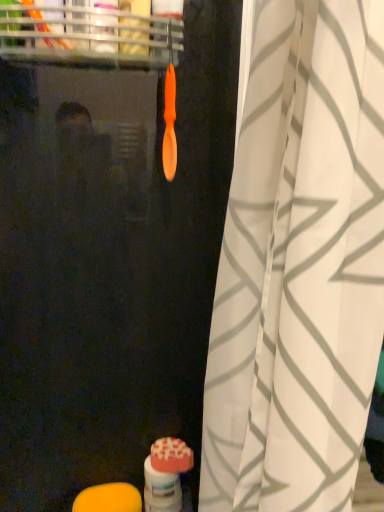
Question: Is orange matte soap at lower left, which is the second soap from top to bottom, a part of matte orange toothbrush at lower center?

Choices:
 (A) no
 (B) yes

Answer: (A)

Question: Can you confirm if matte orange toothbrush at lower center is shorter than orange matte soap at lower left, positioned as the first soap in left-to-right order?

Choices:
 (A) no
 (B) yes

Answer: (A)

Question: Is matte orange toothbrush at lower center facing towards orange matte soap at lower left, which is the 1th soap from bottom to top?

Choices:
 (A) no
 (B) yes

Answer: (A)

Question: Is the depth of matte orange toothbrush at lower center less than that of orange matte soap at lower left, which is the second soap from top to bottom?

Choices:
 (A) no
 (B) yes

Answer: (A)

Question: From a real-world perspective, is matte orange toothbrush at lower center positioned over orange matte soap at lower left, which is the 1th soap from bottom to top, based on gravity?

Choices:
 (A) yes
 (B) no

Answer: (A)

Question: Is matte orange toothbrush at lower center not inside orange matte soap at lower left, positioned as the first soap in left-to-right order?

Choices:
 (A) yes
 (B) no

Answer: (A)

Question: Is orange matte soap at lower left, positioned as the first soap in left-to-right order, next to matte pink soap at lower center, which is counted as the 1th soap, starting from the top?

Choices:
 (A) yes
 (B) no

Answer: (B)

Question: Does orange matte soap at lower left, positioned as the first soap in left-to-right order, have a larger size compared to matte pink soap at lower center, the 1th soap viewed from the right?

Choices:
 (A) yes
 (B) no

Answer: (A)

Question: Is there a large distance between orange matte soap at lower left, which is the second soap from top to bottom, and matte pink soap at lower center, the 1th soap viewed from the right?

Choices:
 (A) yes
 (B) no

Answer: (B)

Question: Can you confirm if orange matte soap at lower left, which is the second soap from top to bottom, is wider than matte pink soap at lower center, acting as the second soap starting from the left?

Choices:
 (A) yes
 (B) no

Answer: (A)

Question: From the image's perspective, is orange matte soap at lower left, which is the 2th soap in right-to-left order, located beneath matte pink soap at lower center, the 1th soap viewed from the right?

Choices:
 (A) yes
 (B) no

Answer: (A)

Question: Is orange matte soap at lower left, which is the 1th soap from bottom to top, thinner than matte pink soap at lower center, the 1th soap viewed from the right?

Choices:
 (A) yes
 (B) no

Answer: (B)

Question: Is matte pink soap at lower center, which is counted as the 1th soap, starting from the top, to the right of white textured curtain at center from the viewer's perspective?

Choices:
 (A) no
 (B) yes

Answer: (A)